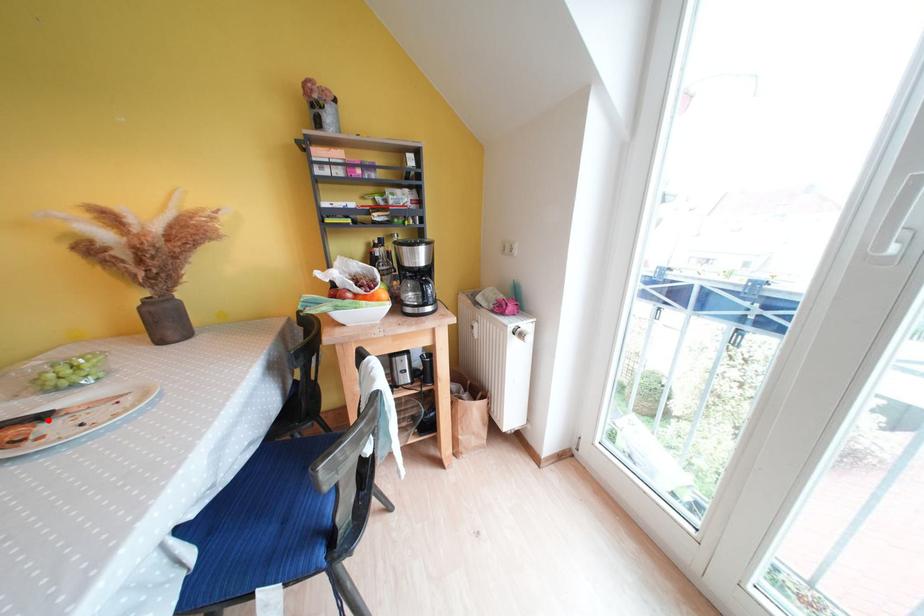
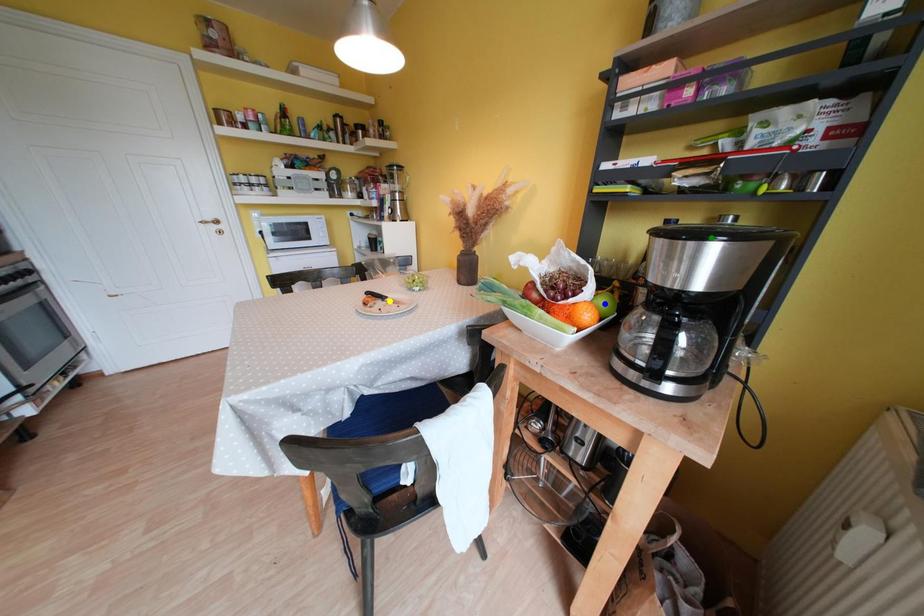
Question: I am providing you with two images of the same scene from different viewpoints. A red point is marked on the first image. You are given multiple points on the second image. Which spot in image 2 lines up with the point in image 1?

Choices:
 (A) yellow point
 (B) blue point
 (C) green point

Answer: (A)